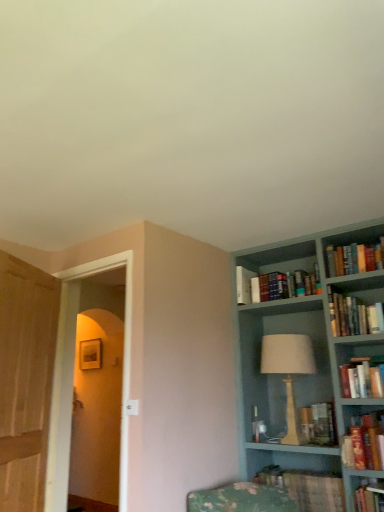
Question: Does point (246, 282) appear closer or farther from the camera than point (241, 270)?

Choices:
 (A) closer
 (B) farther

Answer: (A)

Question: From a real-world perspective, is white matte paperback book at upper right above or below hardcover books at upper right, which is the second book from top to bottom?

Choices:
 (A) above
 (B) below

Answer: (A)

Question: Estimate the real-world distances between objects in this image. Which object is farther from the hardcover books at right, acting as the third book starting from the bottom?

Choices:
 (A) hardcover books at upper right, positioned as the 3th book in top-to-bottom order
 (B) transparent glass door at left, which appears as the 2th glass door when viewed from the left
 (C) hardcover book at lower right, which is counted as the sixth book, starting from the top
 (D) white matte paperback book at upper right
 (E) wooden table lamp at center-right

Answer: (B)

Question: Estimate the real-world distances between objects in this image. Which object is closer to the hardcover books at upper right, positioned as the 6th book in bottom-to-top order?

Choices:
 (A) hardcover books at upper right, which appears as the fifth book when ordered from the bottom
 (B) hardcover book at lower right, acting as the first book starting from the bottom
 (C) transparent glass door at left, which appears as the 2th glass door when viewed from the left
 (D) hardcover books at right, acting as the fourth book starting from the top
 (E) white matte paperback book at upper right

Answer: (A)